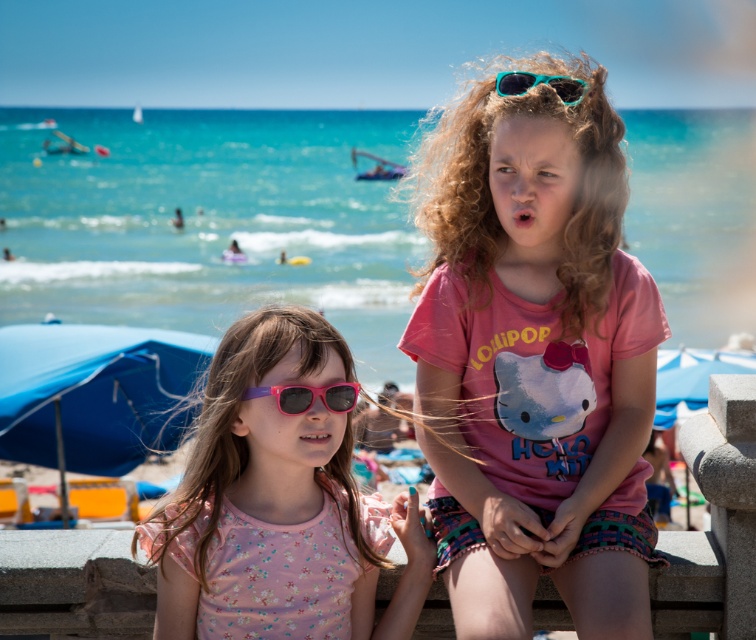
You are a beach photographer and want to capture a clear shot of both the pink matte sunglasses at center and the pink plastic goggles at center. Since you need to focus on the taller object first, which one should you adjust your camera settings for?

The pink matte sunglasses at center is taller than the pink plastic goggles at center, so you should adjust your camera settings for the pink matte sunglasses at center first.

You are a photographer standing at the back of the beach scene. You want to take a photo of both the pink plastic goggles at center and the teal plastic goggles at upper center without any obstructions. Given that your camera has a minimum focus distance of 5 feet, will you be able to capture both objects clearly in the photo?

The distance between the pink plastic goggles at center and the teal plastic goggles at upper center is 5.68 feet, which exceeds the camera minimum focus distance of 5 feet. Therefore, you can capture both objects clearly in the photo.

In the scene shown: You are a photographer trying to capture a closeup shot of the pink matte sunglasses at center and the teal plastic goggles at upper center. Given that your camera lens has a minimum focusing distance of 6 feet, will you be able to take the photo without moving either object?

The distance between the pink matte sunglasses at center and the teal plastic goggles at upper center is 5.93 feet, which is less than the camera lens minimum focusing distance of 6 feet. Therefore, you will not be able to take the photo without moving them closer together.